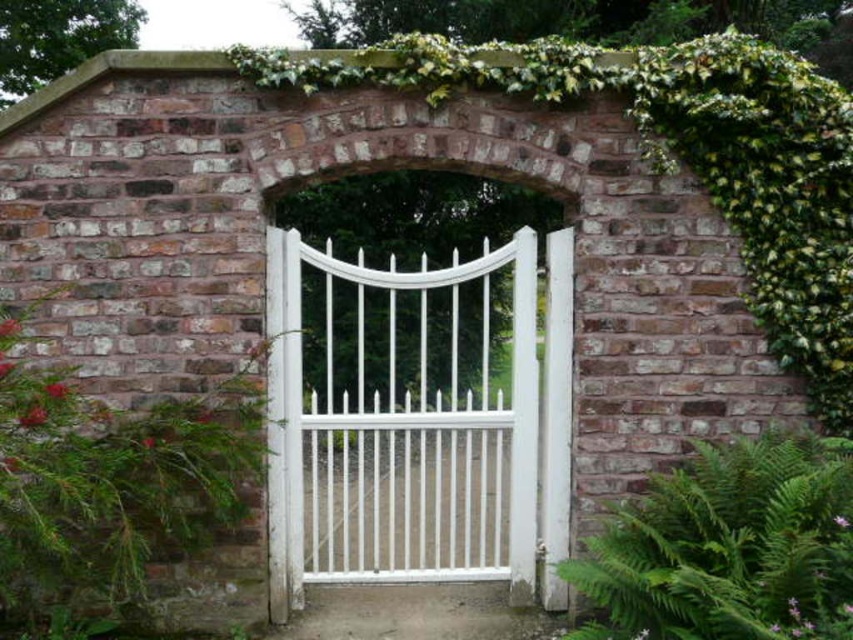
You are a gardener who wants to place a new decorative statue between the white painted metal gate at center and the green leafy fern at lower right. The statue requires a minimum of 1.2 meters of space to be placed safely. Based on the garden layout shown, can you fit the statue between them?

The distance between the white painted metal gate at center and the green leafy fern at lower right is 1.11 meters, which is less than the required 1.2 meters. Therefore, the statue cannot be safely placed between them.

You are standing in front of a garden gate. There is a point at coordinates (399,438). What object is located at that point?

The white painted metal gate at center is located at point (399,438).

You are a painter planning to paint the white painted metal gate at center and the green leafy fern at lower right. You need to know which object is wider to estimate the amount of paint required. Which one is wider?

The white painted metal gate at center is wider than the green leafy fern at lower right according to the description.